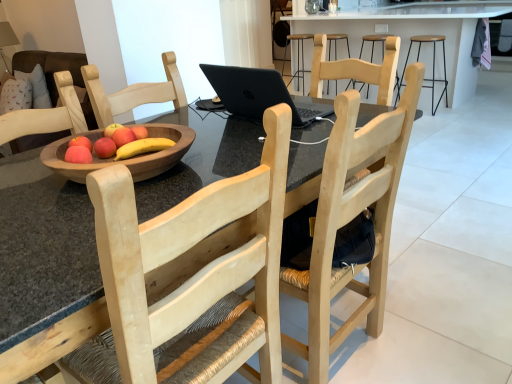
Question: From a real-world perspective, is matte wooden apple at center located higher than black matte laptop at center?

Choices:
 (A) yes
 (B) no

Answer: (B)

Question: Can you confirm if matte wooden apple at center is thinner than black matte laptop at center?

Choices:
 (A) yes
 (B) no

Answer: (A)

Question: Is matte wooden apple at center positioned far away from black matte laptop at center?

Choices:
 (A) no
 (B) yes

Answer: (A)

Question: Does matte wooden apple at center appear on the left side of black matte laptop at center?

Choices:
 (A) no
 (B) yes

Answer: (B)

Question: From the image's perspective, is matte wooden apple at center below black matte laptop at center?

Choices:
 (A) yes
 (B) no

Answer: (A)

Question: Is matte wooden apple at center turned away from black matte laptop at center?

Choices:
 (A) no
 (B) yes

Answer: (A)

Question: Does matte wooden apple at center lie behind metallic black bar stool at center?

Choices:
 (A) no
 (B) yes

Answer: (A)

Question: From the image's perspective, is matte wooden apple at center over metallic black bar stool at center?

Choices:
 (A) yes
 (B) no

Answer: (B)

Question: Is metallic black bar stool at center completely or partially inside matte wooden apple at center?

Choices:
 (A) no
 (B) yes

Answer: (A)

Question: Is matte wooden apple at center bigger than metallic black bar stool at center?

Choices:
 (A) yes
 (B) no

Answer: (B)

Question: Is matte wooden apple at center smaller than metallic black bar stool at center?

Choices:
 (A) no
 (B) yes

Answer: (B)

Question: Is matte wooden apple at center wider than metallic black bar stool at center?

Choices:
 (A) no
 (B) yes

Answer: (A)

Question: From the image's perspective, is black metal stool at upper right located above matte wooden apple at center?

Choices:
 (A) yes
 (B) no

Answer: (A)